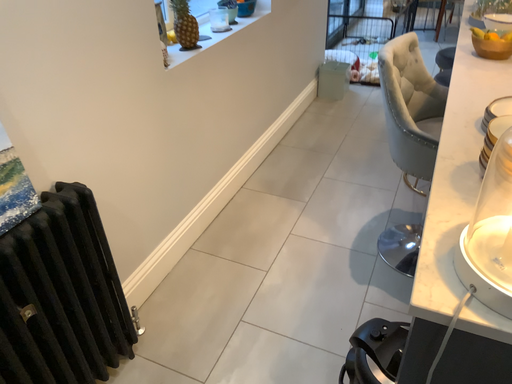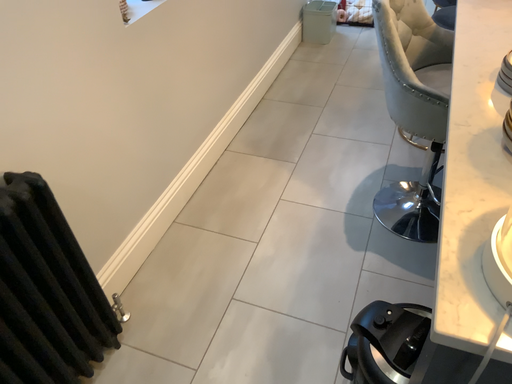
Question: Which way did the camera rotate in the video?

Choices:
 (A) rotated downward
 (B) rotated upward

Answer: (A)